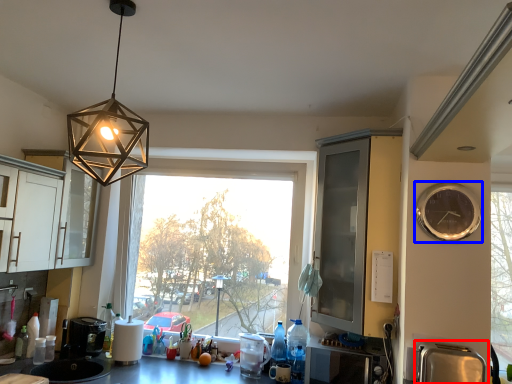
Question: Which object appears farthest to the camera in this image, appliance (highlighted by a red box) or clock (highlighted by a blue box)?

Choices:
 (A) appliance
 (B) clock

Answer: (B)